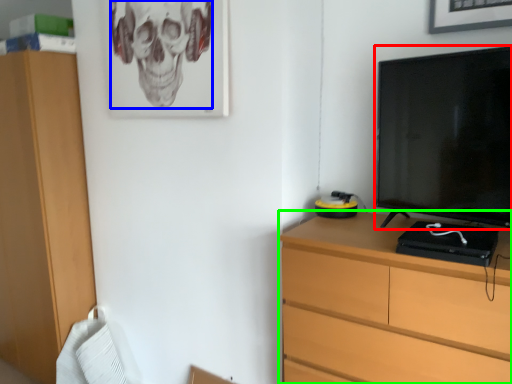
Question: Estimate the real-world distances between objects in this image. Which object is farther from television (highlighted by a red box), skull (highlighted by a blue box) or chest of drawers (highlighted by a green box)?

Choices:
 (A) skull
 (B) chest of drawers

Answer: (A)